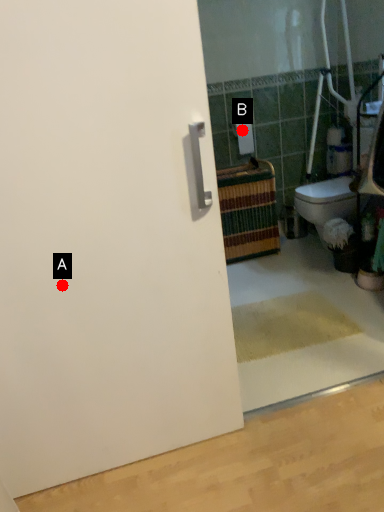
Question: Two points are circled on the image, labeled by A and B beside each circle. Which of the following is the farthest from the observer?

Choices:
 (A) A is further
 (B) B is further

Answer: (B)